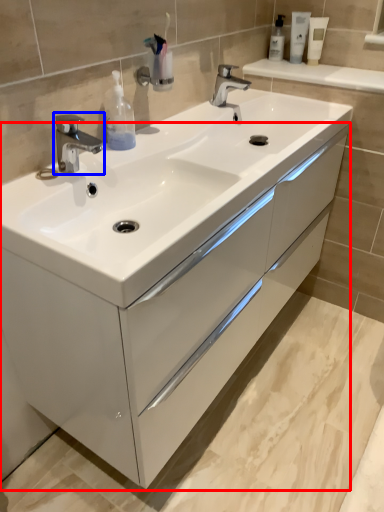
Question: Which point is further to the camera, bathroom cabinet (highlighted by a red box) or tap (highlighted by a blue box)?

Choices:
 (A) bathroom cabinet
 (B) tap

Answer: (B)